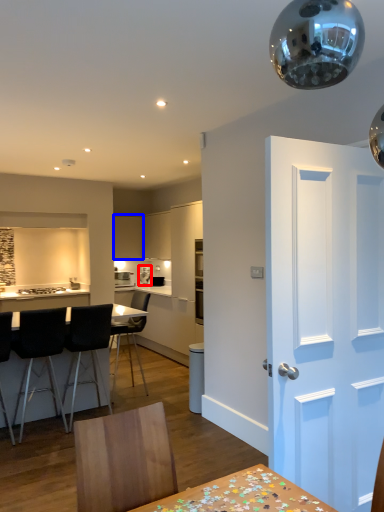
Question: Among these objects, which one is nearest to the camera, appliance (highlighted by a red box) or cabinetry (highlighted by a blue box)?

Choices:
 (A) appliance
 (B) cabinetry

Answer: (B)